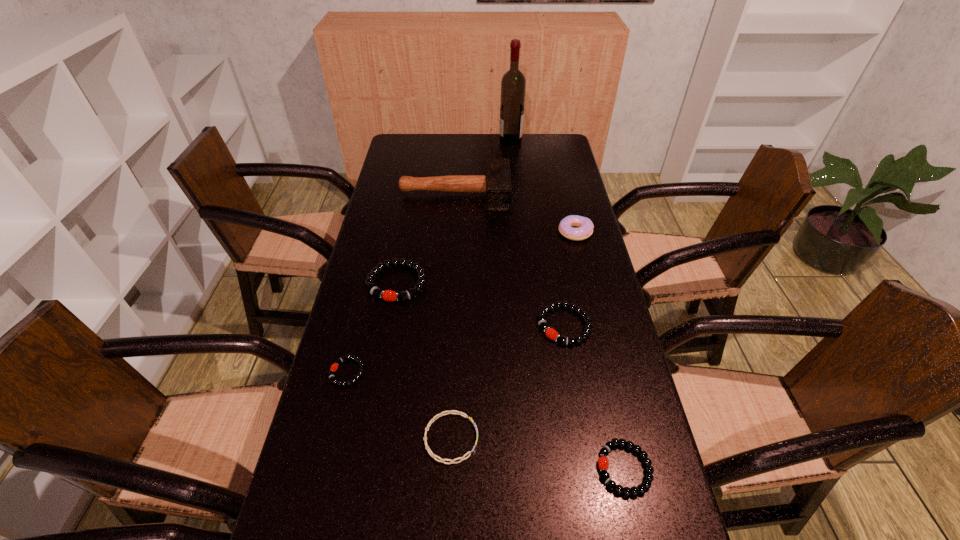
The width and height of the screenshot is (960, 540). I want to click on the third biggest black bracelet, so click(x=603, y=462).

Where is `blue bracelet`? Image resolution: width=960 pixels, height=540 pixels. blue bracelet is located at coordinates (448, 412).

This screenshot has width=960, height=540. What are the coordinates of `the third nearest object` in the screenshot? It's located at (360, 373).

This screenshot has height=540, width=960. Find the location of `the second nearest black bracelet`. the second nearest black bracelet is located at coordinates (360, 373).

Identify the location of free space located on the front and back of the green alcohol. (435, 140).

Identify the location of free spot located 0.150m on the front and back of the green alcohol. (465, 140).

At what (x,y) coordinates should I click in order to perform the action: click on vacant space situated on the front and back of the green alcohol. Please return your answer as a coordinate pair (x, y). Looking at the image, I should click on (435, 140).

Locate an element on the screen. The height and width of the screenshot is (540, 960). vacant space located 0.260m on the hammer head face of the mallet is located at coordinates (580, 194).

Where is `vacant area situated 0.400m on the back of the third farthest object`? The image size is (960, 540). vacant area situated 0.400m on the back of the third farthest object is located at coordinates (558, 161).

Locate an element on the screen. blank area located on the back of the fifth shortest object is located at coordinates pos(403,248).